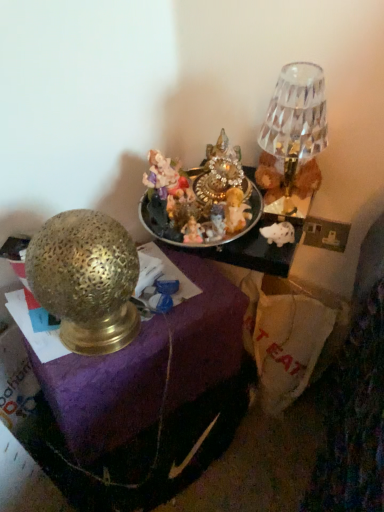
Question: Considering the relative sizes of shiny metallic tray at center and gold textured lamp at left, the first lamp in the bottom-to-top sequence, in the image provided, is shiny metallic tray at center thinner than gold textured lamp at left, the first lamp in the bottom-to-top sequence,?

Choices:
 (A) no
 (B) yes

Answer: (A)

Question: Considering the relative positions of shiny metallic tray at center and gold textured lamp at left, the first lamp in the bottom-to-top sequence, in the image provided, is shiny metallic tray at center to the right of gold textured lamp at left, the first lamp in the bottom-to-top sequence, from the viewer's perspective?

Choices:
 (A) yes
 (B) no

Answer: (A)

Question: From a real-world perspective, is shiny metallic tray at center under gold textured lamp at left, the first lamp in the bottom-to-top sequence?

Choices:
 (A) no
 (B) yes

Answer: (A)

Question: Is shiny metallic tray at center smaller than gold textured lamp at left, acting as the first lamp starting from the left?

Choices:
 (A) no
 (B) yes

Answer: (B)

Question: Is shiny metallic tray at center directly adjacent to gold textured lamp at left, acting as the first lamp starting from the left?

Choices:
 (A) yes
 (B) no

Answer: (B)

Question: Considering their positions, is crystal glass lampshade at upper right, arranged as the second lamp when viewed from the left, located in front of or behind shiny metallic tray at center?

Choices:
 (A) behind
 (B) front

Answer: (B)

Question: In terms of size, does crystal glass lampshade at upper right, the second lamp positioned from the bottom, appear bigger or smaller than shiny metallic tray at center?

Choices:
 (A) big
 (B) small

Answer: (A)

Question: Choose the correct answer: Is crystal glass lampshade at upper right, arranged as the second lamp when viewed from the left, inside shiny metallic tray at center or outside it?

Choices:
 (A) outside
 (B) inside

Answer: (A)

Question: From the image's perspective, is crystal glass lampshade at upper right, arranged as the first lamp when viewed from the top, above or below shiny metallic tray at center?

Choices:
 (A) above
 (B) below

Answer: (A)

Question: Considering their positions, is shiny metallic tray at center located in front of or behind crystal glass lampshade at upper right, the first lamp in the right-to-left sequence?

Choices:
 (A) behind
 (B) front

Answer: (A)

Question: From the image's perspective, is shiny metallic tray at center above or below crystal glass lampshade at upper right, the second lamp positioned from the bottom?

Choices:
 (A) above
 (B) below

Answer: (B)

Question: Does point (253, 212) appear closer or farther from the camera than point (307, 88)?

Choices:
 (A) farther
 (B) closer

Answer: (A)

Question: Is shiny metallic tray at center inside the boundaries of crystal glass lampshade at upper right, arranged as the second lamp when viewed from the left, or outside?

Choices:
 (A) inside
 (B) outside

Answer: (B)

Question: Considering their positions, is crystal glass lampshade at upper right, the first lamp in the right-to-left sequence, located in front of or behind gold textured lamp at left?

Choices:
 (A) behind
 (B) front

Answer: (A)

Question: Is crystal glass lampshade at upper right, arranged as the first lamp when viewed from the top, to the left or to the right of gold textured lamp at left in the image?

Choices:
 (A) left
 (B) right

Answer: (B)